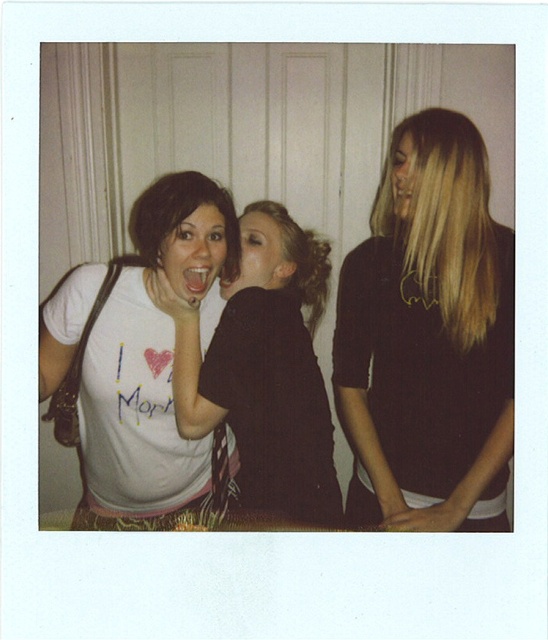
Looking at the scene, which object is smaller between the blonde hair at right and the matte black shirt at center?

The blonde hair at right is smaller than the matte black shirt at center.

Based on the photo, you are standing in the room and want to pick up the dark brown sweater at center. Based on its position, which direction should you move to reach it?

The dark brown sweater at center is located at point (265, 369), so you should move towards the center of the room to reach it.